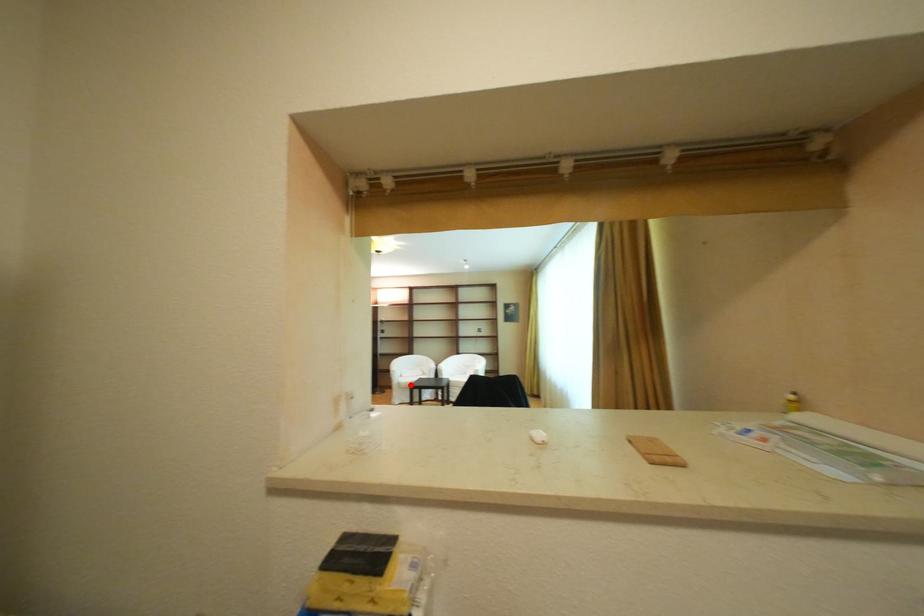
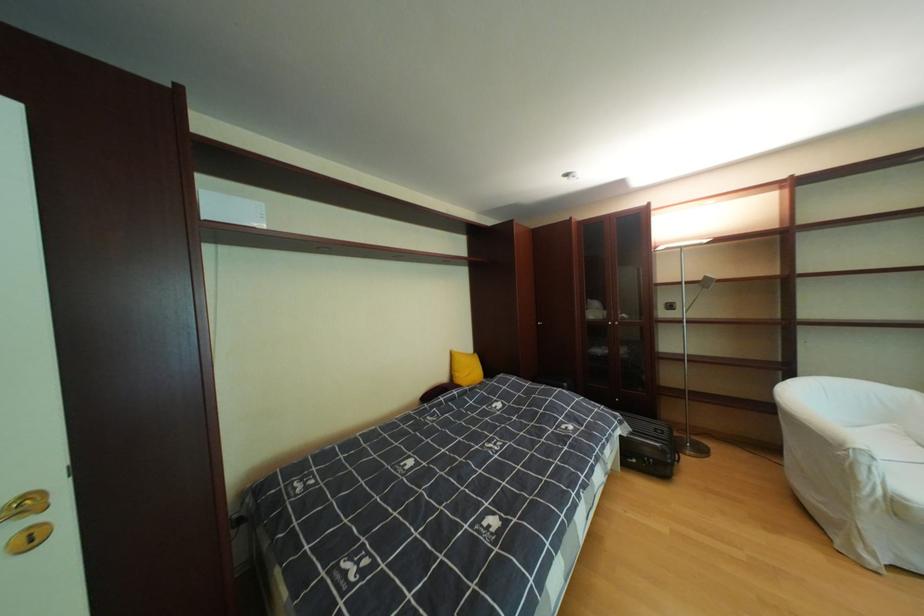
Where in the second image is the point corresponding to the highlighted location from the first image?

(908, 506)